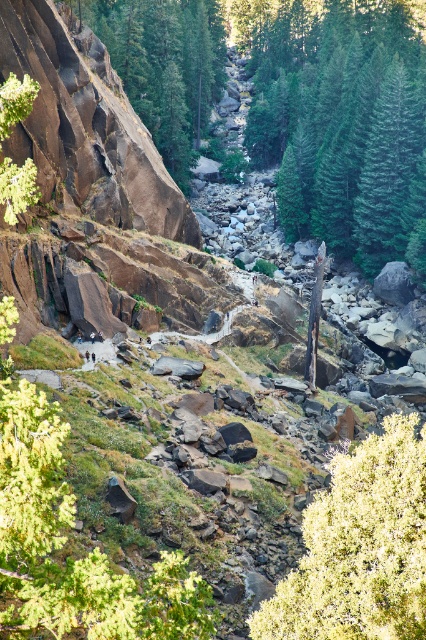
Is green textured tree at center smaller than green fuzzy bush at lower right?

No.

Is the position of green textured tree at center less distant than that of green fuzzy bush at lower right?

No, it is behind green fuzzy bush at lower right.

Who is more distant from viewer, [400,129] or [379,483]?

The point [400,129] is more distant.

Locate an element on the screen. This screenshot has height=640, width=426. green textured tree at center is located at coordinates (345, 125).

Is point (267, 612) less distant than point (149, 112)?

That is True.

The height and width of the screenshot is (640, 426). What are the coordinates of `green fuzzy bush at lower right` in the screenshot? It's located at (359, 548).

Looking at this image, between green textured tree at center and brown rough rock at left, which one appears on the left side from the viewer's perspective?

Positioned to the left is brown rough rock at left.

Who is lower down, green textured tree at center or brown rough rock at left?

brown rough rock at left is lower down.

Is point (270, 132) farther from camera compared to point (206, 97)?

No, (270, 132) is in front of (206, 97).

Locate an element on the screen. The height and width of the screenshot is (640, 426). green textured tree at center is located at coordinates (345, 125).